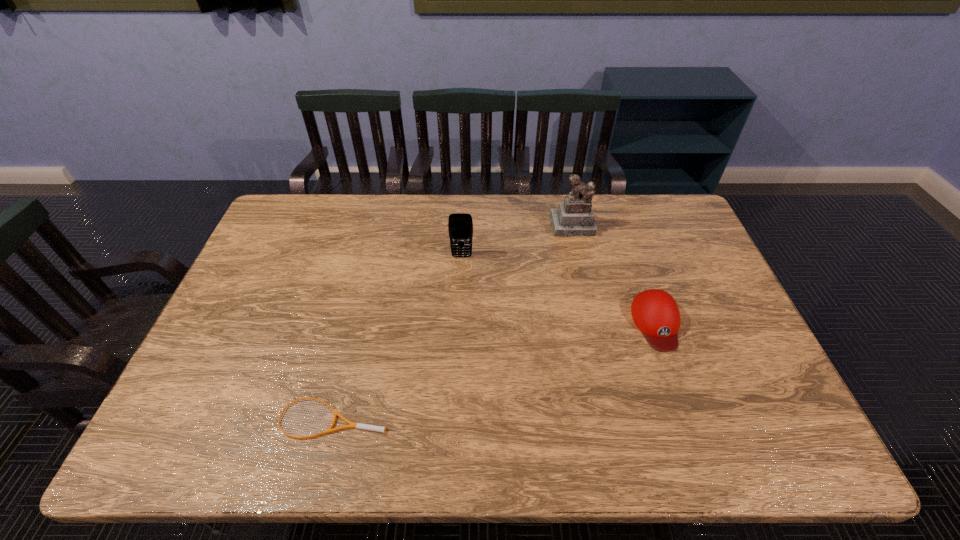
This screenshot has height=540, width=960. I want to click on free space located on the front-facing side of the second nearest object, so click(673, 370).

This screenshot has width=960, height=540. Identify the location of free space located 0.220m on the right of the tennis racket. (481, 418).

This screenshot has height=540, width=960. Identify the location of object that is at the far edge. (574, 217).

Where is `object positioned at the near edge`? The height and width of the screenshot is (540, 960). object positioned at the near edge is located at coordinates [x=356, y=425].

What are the coordinates of `free space at the far edge` in the screenshot? It's located at (628, 207).

In the image, there is a desktop. At what (x,y) coordinates should I click in order to perform the action: click on vacant space at the near edge. Please return your answer as a coordinate pair (x, y). The image size is (960, 540). Looking at the image, I should click on (712, 450).

Where is `vacant space at the right edge of the desktop`? The height and width of the screenshot is (540, 960). vacant space at the right edge of the desktop is located at coordinates (664, 248).

The image size is (960, 540). I want to click on vacant area at the far left corner of the desktop, so click(x=268, y=235).

Find the location of a particular element. free spot at the near left corner of the desktop is located at coordinates (192, 438).

Where is `unoccupied position between the nearest object and the third object from right to left`? This screenshot has width=960, height=540. unoccupied position between the nearest object and the third object from right to left is located at coordinates (398, 337).